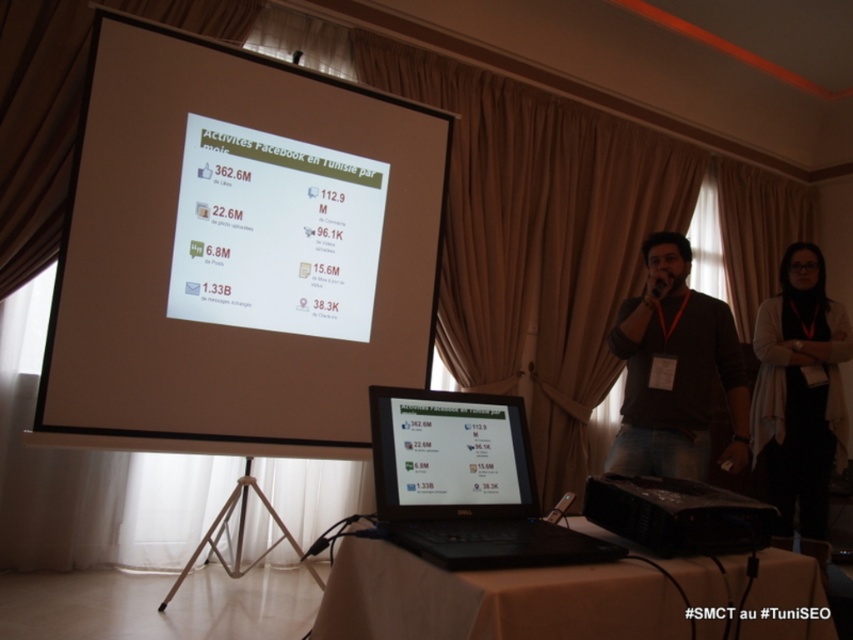
What do you see at coordinates (525, 596) in the screenshot?
I see `white cloth-covered table at center` at bounding box center [525, 596].

Is white cloth-covered table at center positioned in front of brown cotton shirt at center?

Yes.

Who is more distant from viewer, (x=596, y=634) or (x=693, y=388)?

The point (x=693, y=388) is behind.

Locate an element on the screen. white cloth-covered table at center is located at coordinates (525, 596).

Image resolution: width=853 pixels, height=640 pixels. Identify the location of white matte projector screen at upper center. (238, 252).

Can you confirm if white matte projector screen at upper center is positioned above black plastic projector at center?

Yes, white matte projector screen at upper center is above black plastic projector at center.

Image resolution: width=853 pixels, height=640 pixels. What are the coordinates of `white matte projector screen at upper center` in the screenshot? It's located at (238, 252).

What do you see at coordinates (238, 252) in the screenshot? I see `white matte projector screen at upper center` at bounding box center [238, 252].

Between point (392, 333) and point (675, 369), which one is positioned in front?

Positioned in front is point (675, 369).

Is point (335, 147) more distant than point (674, 460)?

Yes, it is behind point (674, 460).

Locate an element on the screen. The width and height of the screenshot is (853, 640). white matte projector screen at upper center is located at coordinates (238, 252).